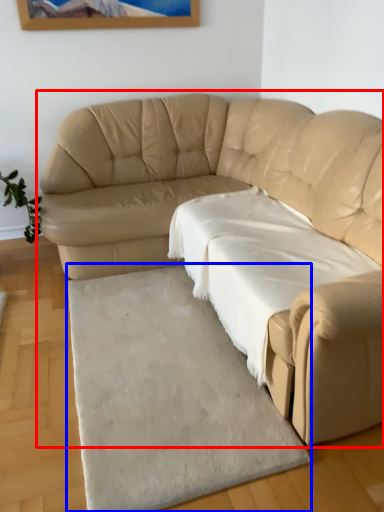
Question: Which point is closer to the camera, studio couch (highlighted by a red box) or mat (highlighted by a blue box)?

Choices:
 (A) studio couch
 (B) mat

Answer: (A)